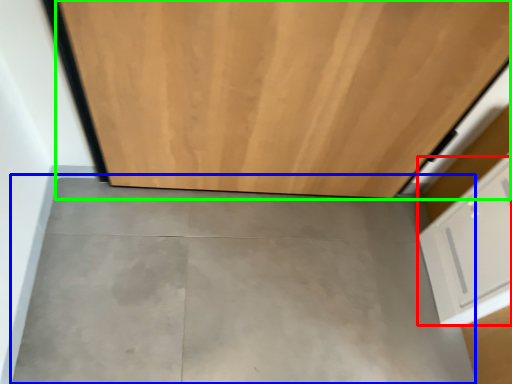
Question: Which is nearer to the drawer (highlighted by a red box)? concrete (highlighted by a blue box) or door (highlighted by a green box).

Choices:
 (A) concrete
 (B) door

Answer: (A)